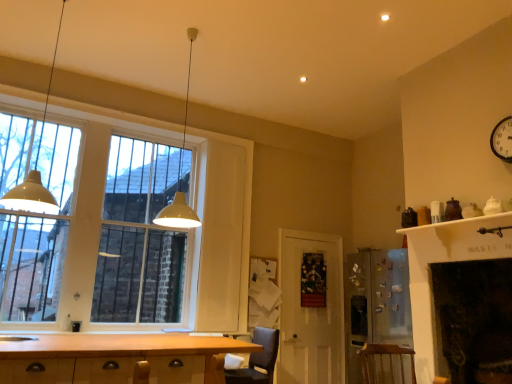
Question: Is matte glass window at left not inside white glossy sink at lower left?

Choices:
 (A) yes
 (B) no

Answer: (A)

Question: Considering the relative sizes of matte glass window at left and white glossy sink at lower left in the image provided, is matte glass window at left shorter than white glossy sink at lower left?

Choices:
 (A) no
 (B) yes

Answer: (A)

Question: Would you say white glossy sink at lower left is part of matte glass window at left's contents?

Choices:
 (A) no
 (B) yes

Answer: (A)

Question: Is matte glass window at left turned away from white glossy sink at lower left?

Choices:
 (A) no
 (B) yes

Answer: (A)

Question: Can you confirm if matte glass window at left is wider than white glossy sink at lower left?

Choices:
 (A) no
 (B) yes

Answer: (A)

Question: Looking at the image, does matte glass window at left seem bigger or smaller compared to matte yellow pendant light at upper center, positioned as the 2th light fixture in left-to-right order?

Choices:
 (A) big
 (B) small

Answer: (A)

Question: Considering their positions, is matte glass window at left located in front of or behind matte yellow pendant light at upper center, the 1th light fixture viewed from the right?

Choices:
 (A) behind
 (B) front

Answer: (A)

Question: From the image's perspective, is matte glass window at left positioned above or below matte yellow pendant light at upper center, the 1th light fixture viewed from the right?

Choices:
 (A) above
 (B) below

Answer: (B)

Question: Would you say matte glass window at left is inside or outside matte yellow pendant light at upper center, the 1th light fixture viewed from the right?

Choices:
 (A) inside
 (B) outside

Answer: (B)

Question: From a real-world perspective, is white wooden door at center above or below white glossy clock at upper right?

Choices:
 (A) below
 (B) above

Answer: (A)

Question: In terms of width, does white wooden door at center look wider or thinner when compared to white glossy clock at upper right?

Choices:
 (A) wide
 (B) thin

Answer: (A)

Question: Is point click(x=317, y=327) positioned closer to the camera than point click(x=501, y=125)?

Choices:
 (A) closer
 (B) farther

Answer: (B)

Question: From their relative heights in the image, would you say white wooden door at center is taller or shorter than white glossy clock at upper right?

Choices:
 (A) short
 (B) tall

Answer: (B)

Question: Considering their positions, is wooden at lower right, the second armchair viewed from the left, located in front of or behind matte glass window at left?

Choices:
 (A) behind
 (B) front

Answer: (B)

Question: Considering the positions of wooden at lower right, arranged as the first armchair when viewed from the right, and matte glass window at left in the image, is wooden at lower right, arranged as the first armchair when viewed from the right, bigger or smaller than matte glass window at left?

Choices:
 (A) big
 (B) small

Answer: (B)